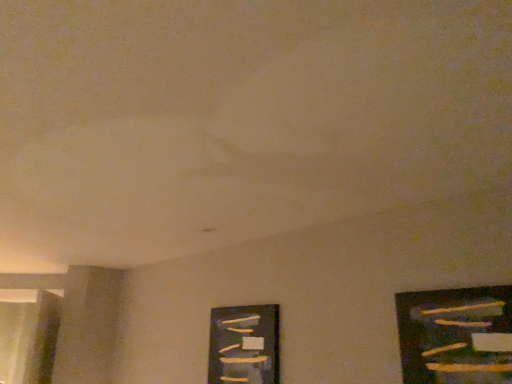
What do you see at coordinates (244, 345) in the screenshot?
I see `wooden frame at lower center, placed as the 2th picture frame when sorted from right to left` at bounding box center [244, 345].

This screenshot has width=512, height=384. Identify the location of wooden frame at lower center, which is the first picture frame from left to right. (244, 345).

In order to face wooden frame at lower center, which is the first picture frame from left to right, should I rotate leftwards or rightwards?

A 1.919 degree turn to the left will do.

This screenshot has width=512, height=384. Describe the element at coordinates (456, 335) in the screenshot. I see `wooden frame at right, arranged as the 2th picture frame when viewed from the back` at that location.

At what (x,y) coordinates should I click in order to perform the action: click on wooden frame at right, positioned as the first picture frame in front-to-back order. Please return your answer as a coordinate pair (x, y). This screenshot has width=512, height=384. Looking at the image, I should click on (456, 335).

Measure the distance between wooden frame at right, the first picture frame positioned from the right, and camera.

The distance of wooden frame at right, the first picture frame positioned from the right, from camera is 5.44 feet.

At what (x,y) coordinates should I click in order to perform the action: click on wooden frame at lower center, placed as the 2th picture frame when sorted from right to left. Please return your answer as a coordinate pair (x, y). Looking at the image, I should click on (244, 345).

Is wooden frame at right, the first picture frame positioned from the right, at the left side of wooden frame at lower center, positioned as the 2th picture frame in front-to-back order?

No, wooden frame at right, the first picture frame positioned from the right, is not to the left of wooden frame at lower center, positioned as the 2th picture frame in front-to-back order.

In the image, is wooden frame at right, arranged as the 2th picture frame when viewed from the back, positioned in front of or behind wooden frame at lower center, placed as the 2th picture frame when sorted from right to left?

wooden frame at right, arranged as the 2th picture frame when viewed from the back, is in front of wooden frame at lower center, placed as the 2th picture frame when sorted from right to left.

Which point is more forward, (x=442, y=345) or (x=262, y=367)?

The point (x=442, y=345) is closer to the camera.

From the image's perspective, does wooden frame at right, arranged as the 2th picture frame when viewed from the back, appear lower than wooden frame at lower center, placed as the 2th picture frame when sorted from right to left?

No, from the image's perspective, wooden frame at right, arranged as the 2th picture frame when viewed from the back, is not below wooden frame at lower center, placed as the 2th picture frame when sorted from right to left.

From a real-world perspective, which is physically above, wooden frame at right, the first picture frame positioned from the right, or wooden frame at lower center, the first picture frame from the back?

wooden frame at right, the first picture frame positioned from the right.

Which of these two, wooden frame at right, which ranks as the second picture frame in left-to-right order, or wooden frame at lower center, which is the first picture frame from left to right, is thinner?

wooden frame at right, which ranks as the second picture frame in left-to-right order, is thinner.

Considering the sizes of objects wooden frame at right, arranged as the 2th picture frame when viewed from the back, and wooden frame at lower center, the first picture frame from the back, in the image provided, who is shorter, wooden frame at right, arranged as the 2th picture frame when viewed from the back, or wooden frame at lower center, the first picture frame from the back,?

Standing shorter between the two is wooden frame at right, arranged as the 2th picture frame when viewed from the back.

Does wooden frame at right, which ranks as the second picture frame in left-to-right order, have a smaller size compared to wooden frame at lower center, the first picture frame from the back?

Indeed, wooden frame at right, which ranks as the second picture frame in left-to-right order, has a smaller size compared to wooden frame at lower center, the first picture frame from the back.

Is wooden frame at right, positioned as the first picture frame in front-to-back order, outside of wooden frame at lower center, which is the first picture frame from left to right?

Indeed, wooden frame at right, positioned as the first picture frame in front-to-back order, is completely outside wooden frame at lower center, which is the first picture frame from left to right.

Would you consider wooden frame at right, arranged as the 2th picture frame when viewed from the back, to be distant from wooden frame at lower center, placed as the 2th picture frame when sorted from right to left?

Absolutely, wooden frame at right, arranged as the 2th picture frame when viewed from the back, is distant from wooden frame at lower center, placed as the 2th picture frame when sorted from right to left.

Is wooden frame at lower center, the first picture frame from the back, at the back of wooden frame at right, positioned as the first picture frame in front-to-back order?

No.

Consider the image. Can you tell me how much wooden frame at right, positioned as the first picture frame in front-to-back order, and wooden frame at lower center, the first picture frame from the back, differ in facing direction?

0.0973 degrees separate the facing orientations of wooden frame at right, positioned as the first picture frame in front-to-back order, and wooden frame at lower center, the first picture frame from the back.

You are a GUI agent. You are given a task and a screenshot of the screen. Output one action in this format:
    pyautogui.click(x=<x>, y=<y>)
    Task: Click on the picture frame above the wooden frame at lower center, placed as the 2th picture frame when sorted from right to left (from the image's perspective)
    The width and height of the screenshot is (512, 384).
    Given the screenshot: What is the action you would take?
    pyautogui.click(x=456, y=335)

Looking at this image, considering the positions of objects wooden frame at lower center, which is the first picture frame from left to right, and wooden frame at right, the first picture frame positioned from the right, in the image provided, who is more to the left, wooden frame at lower center, which is the first picture frame from left to right, or wooden frame at right, the first picture frame positioned from the right,?

wooden frame at lower center, which is the first picture frame from left to right, is more to the left.

In the image, is wooden frame at lower center, the first picture frame from the back, positioned in front of or behind wooden frame at right, arranged as the 2th picture frame when viewed from the back?

wooden frame at lower center, the first picture frame from the back, is behind wooden frame at right, arranged as the 2th picture frame when viewed from the back.

Is point (268, 361) closer or farther from the camera than point (416, 306)?

Point (268, 361).

From the image's perspective, which one is positioned lower, wooden frame at lower center, which is the first picture frame from left to right, or wooden frame at right, positioned as the first picture frame in front-to-back order?

From the image's view, wooden frame at lower center, which is the first picture frame from left to right, is below.

From a real-world perspective, is wooden frame at lower center, placed as the 2th picture frame when sorted from right to left, located higher than wooden frame at right, the first picture frame positioned from the right?

Actually, wooden frame at lower center, placed as the 2th picture frame when sorted from right to left, is physically below wooden frame at right, the first picture frame positioned from the right, in the real world.

Is wooden frame at lower center, placed as the 2th picture frame when sorted from right to left, thinner than wooden frame at right, arranged as the 2th picture frame when viewed from the back?

No.

Is wooden frame at lower center, the first picture frame from the back, shorter than wooden frame at right, arranged as the 2th picture frame when viewed from the back?

No.

Considering the sizes of objects wooden frame at lower center, placed as the 2th picture frame when sorted from right to left, and wooden frame at right, which ranks as the second picture frame in left-to-right order, in the image provided, who is bigger, wooden frame at lower center, placed as the 2th picture frame when sorted from right to left, or wooden frame at right, which ranks as the second picture frame in left-to-right order,?

wooden frame at lower center, placed as the 2th picture frame when sorted from right to left, is bigger.

Is wooden frame at right, arranged as the 2th picture frame when viewed from the back, completely or partially inside wooden frame at lower center, the first picture frame from the back?

Definitely not — wooden frame at right, arranged as the 2th picture frame when viewed from the back, is not inside wooden frame at lower center, the first picture frame from the back.

Is wooden frame at lower center, positioned as the 2th picture frame in front-to-back order, next to wooden frame at right, positioned as the first picture frame in front-to-back order, and touching it?

No, wooden frame at lower center, positioned as the 2th picture frame in front-to-back order, is not next to wooden frame at right, positioned as the first picture frame in front-to-back order.

Is wooden frame at lower center, placed as the 2th picture frame when sorted from right to left, turned away from wooden frame at right, which ranks as the second picture frame in left-to-right order?

No, wooden frame at lower center, placed as the 2th picture frame when sorted from right to left,'s orientation is not away from wooden frame at right, which ranks as the second picture frame in left-to-right order.

Image resolution: width=512 pixels, height=384 pixels. I want to click on picture frame located above the wooden frame at lower center, placed as the 2th picture frame when sorted from right to left (from the image's perspective), so click(456, 335).

Find the location of a particular element. The height and width of the screenshot is (384, 512). picture frame that appears on the right of wooden frame at lower center, the first picture frame from the back is located at coordinates (456, 335).

I want to click on picture frame in front of the wooden frame at lower center, which is the first picture frame from left to right, so click(x=456, y=335).